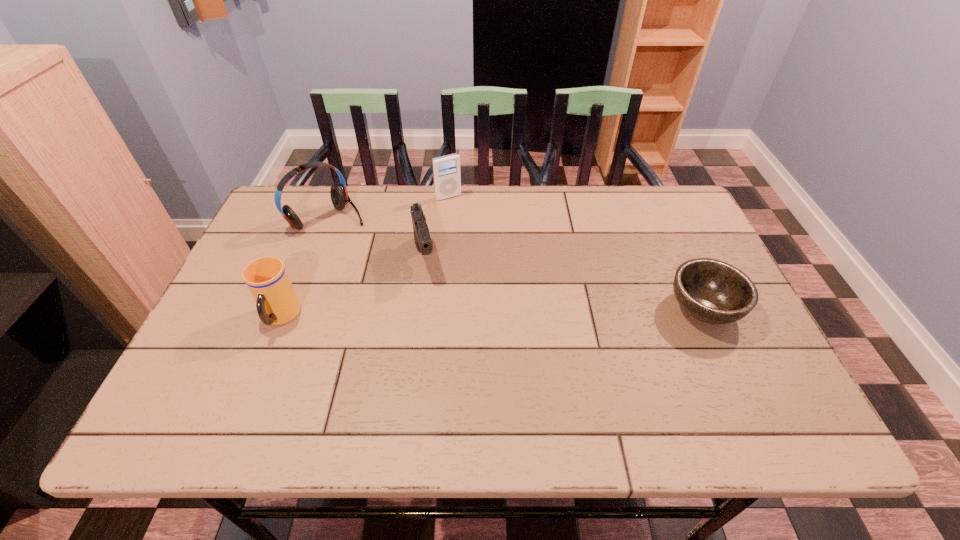
Identify the location of free space on the desktop that is between the cup and the shortest object and is positioned at the barrel of the pistol. (440, 314).

Find the location of a particular element. vacant space on the desktop that is between the cup and the shortest object and is positioned with the microphone attached to the side of the tallest object is located at coordinates (435, 314).

Where is `free space on the desktop that is between the cup and the rightmost object and is positioned on the front-facing side of the farthest object`? This screenshot has height=540, width=960. free space on the desktop that is between the cup and the rightmost object and is positioned on the front-facing side of the farthest object is located at coordinates (524, 312).